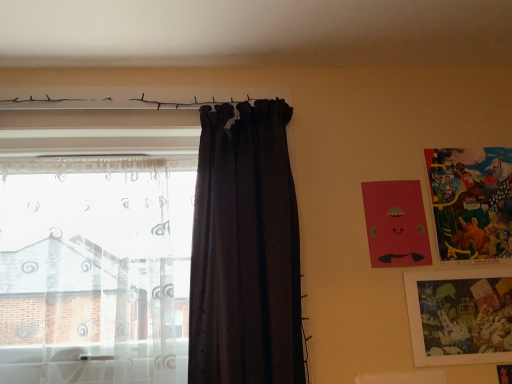
Question: Which is correct: dark matte fabric curtain at center, the first curtain when ordered from right to left, is inside matte plastic picture frame at lower right, which ranks as the 3th picture frame in top-to-bottom order, or outside of it?

Choices:
 (A) outside
 (B) inside

Answer: (A)

Question: Is dark matte fabric curtain at center, the first curtain when ordered from right to left, wider or thinner than matte plastic picture frame at lower right, which ranks as the 3th picture frame in top-to-bottom order?

Choices:
 (A) wide
 (B) thin

Answer: (A)

Question: Which is farther from the dark matte fabric curtain at center, the first curtain when ordered from right to left?

Choices:
 (A) multicolored paper picture frame at upper right, acting as the third picture frame starting from the bottom
 (B) matte plastic picture frame at lower right, which ranks as the 3th picture frame in top-to-bottom order
 (C) transparent sheer curtain at left, the 2th curtain when ordered from right to left
 (D) matte red picture frame at upper right, marked as the second picture frame in a bottom-to-top arrangement

Answer: (A)

Question: Considering the real-world distances, which object is farthest from the matte plastic picture frame at lower right, which ranks as the 3th picture frame in top-to-bottom order?

Choices:
 (A) dark matte fabric curtain at center, the first curtain when ordered from right to left
 (B) transparent sheer curtain at left, the 1th curtain from the left
 (C) multicolored paper picture frame at upper right, acting as the third picture frame starting from the bottom
 (D) matte red picture frame at upper right, marked as the second picture frame in a bottom-to-top arrangement

Answer: (B)